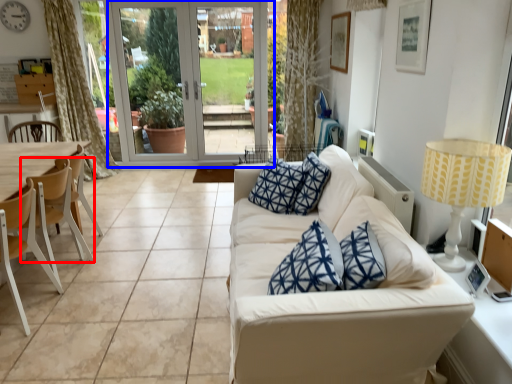
Question: Which object is closer to the camera taking this photo, chair (highlighted by a red box) or screen door (highlighted by a blue box)?

Choices:
 (A) chair
 (B) screen door

Answer: (A)